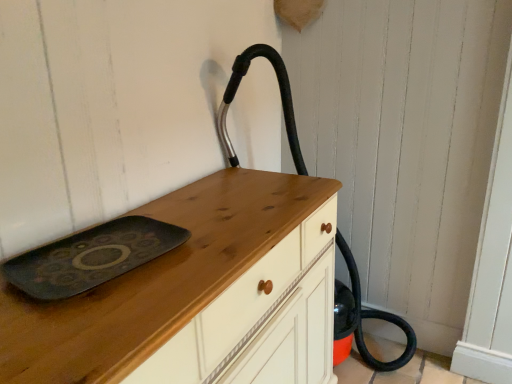
Question: Does matte black tray at center come behind black rubber hose at center?

Choices:
 (A) no
 (B) yes

Answer: (A)

Question: Is matte black tray at center far from black rubber hose at center?

Choices:
 (A) yes
 (B) no

Answer: (A)

Question: Considering the relative positions of matte black tray at center and black rubber hose at center in the image provided, is matte black tray at center to the right of black rubber hose at center from the viewer's perspective?

Choices:
 (A) no
 (B) yes

Answer: (A)

Question: From the image's perspective, is matte black tray at center under black rubber hose at center?

Choices:
 (A) yes
 (B) no

Answer: (A)

Question: Is matte black tray at center surrounding black rubber hose at center?

Choices:
 (A) no
 (B) yes

Answer: (A)

Question: Considering the positions of point (241, 64) and point (88, 379), is point (241, 64) closer or farther from the camera than point (88, 379)?

Choices:
 (A) farther
 (B) closer

Answer: (A)

Question: From a real-world perspective, is black rubber hose at center above or below wooden chest of drawers at center?

Choices:
 (A) above
 (B) below

Answer: (A)

Question: Looking at their shapes, would you say black rubber hose at center is wider or thinner than wooden chest of drawers at center?

Choices:
 (A) thin
 (B) wide

Answer: (B)

Question: Is black rubber hose at center to the left or to the right of wooden chest of drawers at center in the image?

Choices:
 (A) right
 (B) left

Answer: (A)

Question: Is wooden chest of drawers at center inside or outside of black rubber hose at center?

Choices:
 (A) outside
 (B) inside

Answer: (A)

Question: From their relative heights in the image, would you say wooden chest of drawers at center is taller or shorter than black rubber hose at center?

Choices:
 (A) tall
 (B) short

Answer: (B)

Question: Based on their positions, is wooden chest of drawers at center located to the left or right of black rubber hose at center?

Choices:
 (A) right
 (B) left

Answer: (B)

Question: Is wooden chest of drawers at center in front of or behind black rubber hose at center in the image?

Choices:
 (A) front
 (B) behind

Answer: (A)

Question: In terms of size, does matte black tray at center appear bigger or smaller than black rubber hose at center?

Choices:
 (A) small
 (B) big

Answer: (A)

Question: In terms of height, does matte black tray at center look taller or shorter compared to black rubber hose at center?

Choices:
 (A) short
 (B) tall

Answer: (A)